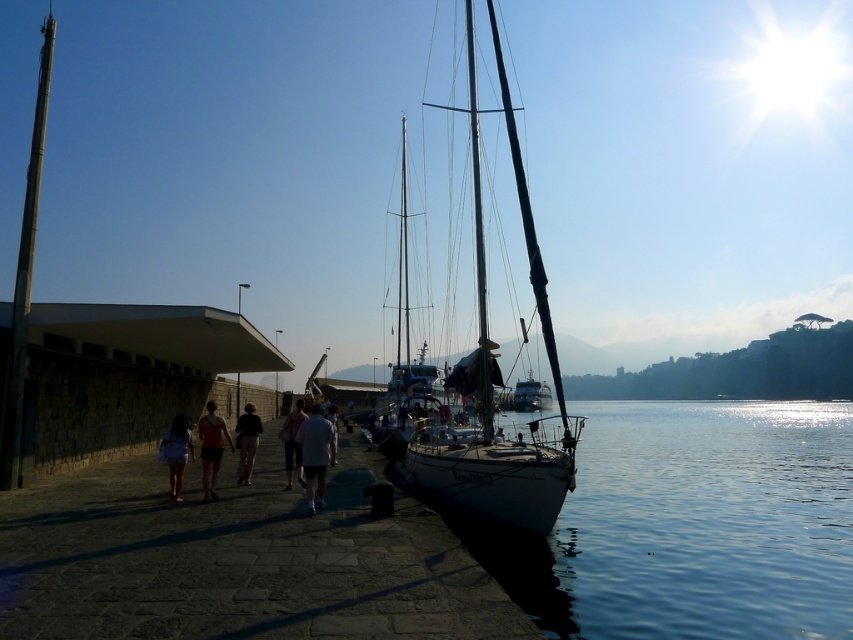
Question: Which point appears farthest from the camera in this image?

Choices:
 (A) (16, 330)
 (B) (412, 433)
 (C) (331, 456)
 (D) (306, 497)

Answer: (B)

Question: Among these points, which one is nearest to the camera?

Choices:
 (A) (13, 305)
 (B) (213, 440)

Answer: (B)

Question: Which point appears farthest from the camera in this image?

Choices:
 (A) (187, 444)
 (B) (590, 632)
 (C) (556, 492)
 (D) (227, 468)

Answer: (D)

Question: Is black fabric jacket at center further to camera compared to light brown shorts at center?

Choices:
 (A) yes
 (B) no

Answer: (A)

Question: Does light gray cotton shirt at center appear over dark blue shorts at center?

Choices:
 (A) yes
 (B) no

Answer: (A)

Question: Does smooth stone walkway at center appear over matte pink shorts at center?

Choices:
 (A) no
 (B) yes

Answer: (A)